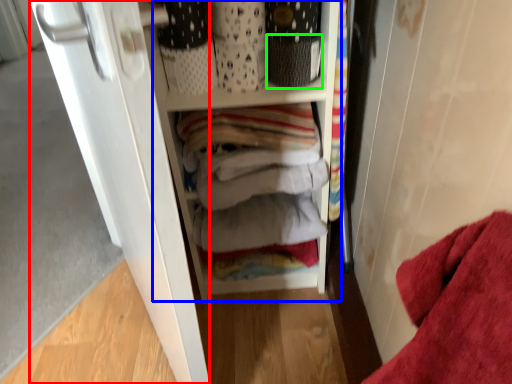
Question: Which object is positioned closest to door (highlighted by a red box)? Select from cabinetry (highlighted by a blue box) and basket (highlighted by a green box).

Choices:
 (A) cabinetry
 (B) basket

Answer: (A)